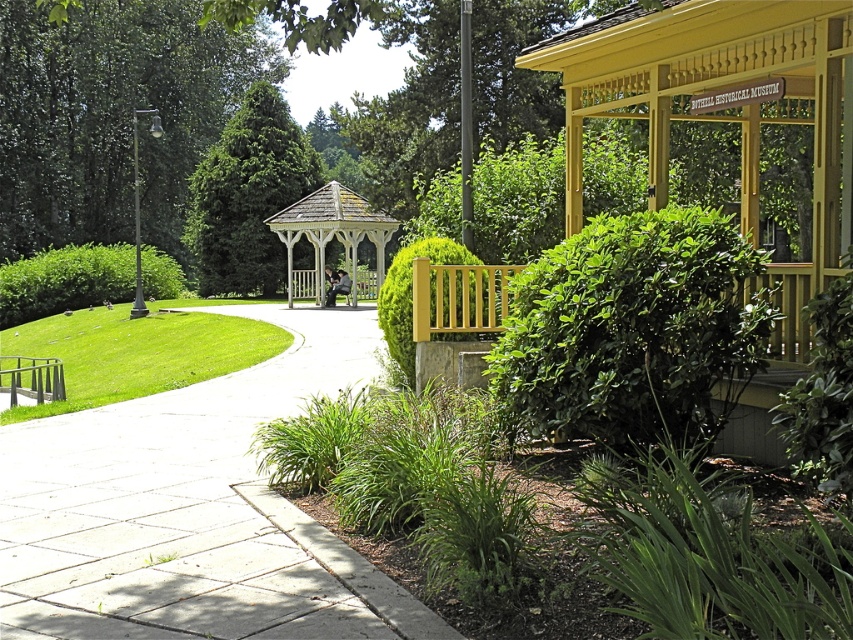
You are a visitor in the park and want to sit on the wooden park bench at center. However, you notice the green leafy tree at upper left. Will the tree block your view of the yellow gazebo to the right when you sit there?

The wooden park bench at center is behind the green leafy tree at upper left, so sitting there might block your view of the yellow gazebo to the right due to the tree being in front of you.

You are a gardener planning to water the green leafy bush at left and the concrete at center. Since you can only water one area at a time, which area is closer to your current position if you are standing at the entrance of the yellow gazebo on the right?

The green leafy bush at left is closer to your current position because the concrete at center is to the right of the green leafy bush at left, meaning the bush is positioned between you and the concrete. Since you are at the yellow gazebo on the right, the bush would be nearer to you than the concrete.